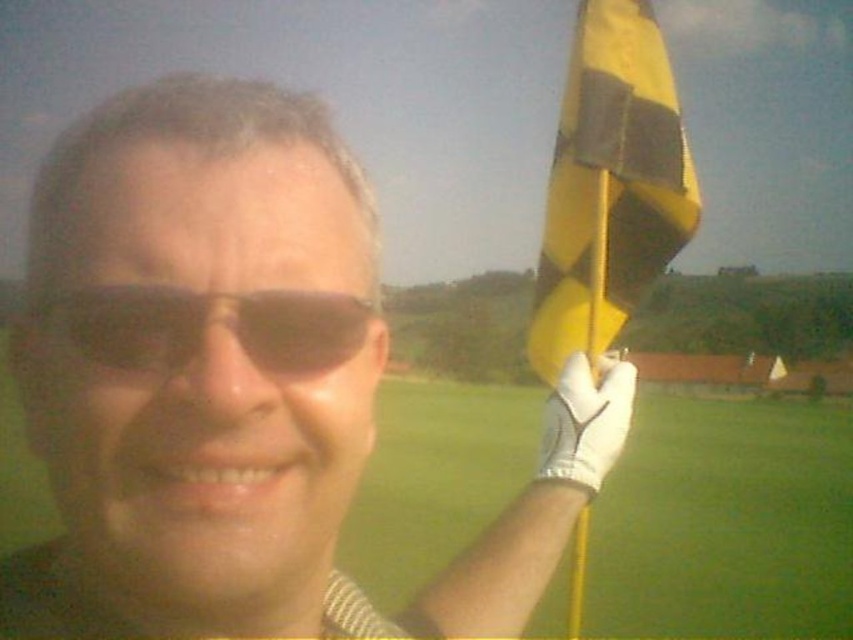
Question: Where is white textured glove at upper right located in relation to black matte sunglasses at center in the image?

Choices:
 (A) left
 (B) right

Answer: (A)

Question: Which object appears closest to the camera in this image?

Choices:
 (A) white textured glove at upper right
 (B) black matte sunglasses at center
 (C) yellow fabric flag at right

Answer: (B)

Question: Which point is closer to the camera?

Choices:
 (A) yellow/black striped flag at upper right
 (B) white textured glove at upper right
 (C) yellow fabric flag at right
 (D) white textured glove at right

Answer: (B)

Question: In this image, where is yellow fabric flag at right located relative to yellow/black striped flag at upper right?

Choices:
 (A) above
 (B) below

Answer: (B)

Question: Which of the following is the closest to the observer?

Choices:
 (A) (502, 515)
 (B) (691, 545)
 (C) (624, 417)

Answer: (C)

Question: Does white textured glove at upper right have a greater width compared to yellow fabric flag at right?

Choices:
 (A) yes
 (B) no

Answer: (B)